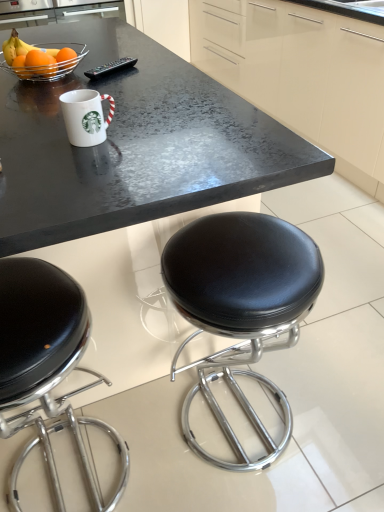
At what (x,y) coordinates should I click in order to perform the action: click on vacant area that lies to the right of black plastic remote control at upper center. Please return your answer as a coordinate pair (x, y). Image resolution: width=384 pixels, height=512 pixels. Looking at the image, I should click on (160, 68).